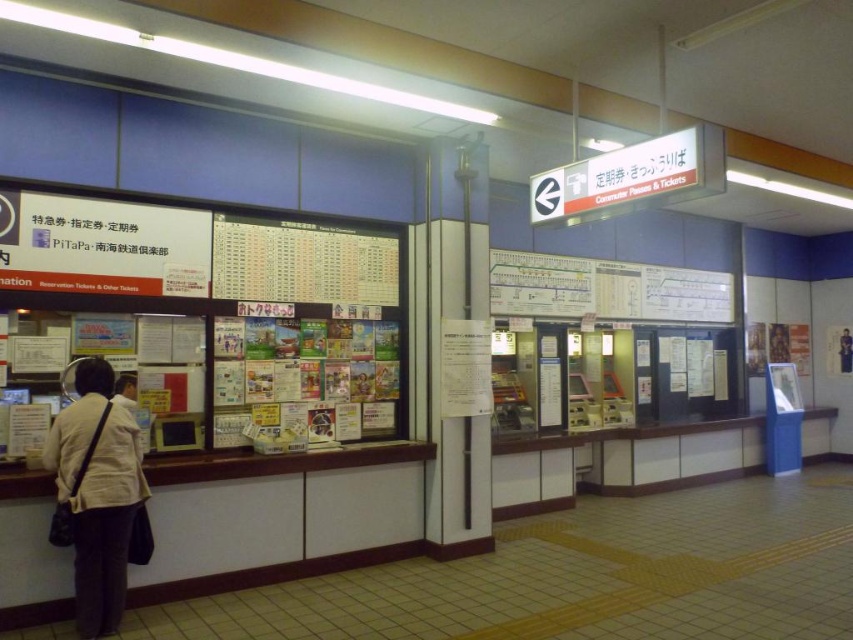
Question: Is beige fabric jacket at lower left above light beige jacket at left?

Choices:
 (A) no
 (B) yes

Answer: (A)

Question: Considering the relative positions of beige fabric jacket at lower left and light beige jacket at left in the image provided, where is beige fabric jacket at lower left located with respect to light beige jacket at left?

Choices:
 (A) left
 (B) right

Answer: (B)

Question: Which point is closer to the camera taking this photo?

Choices:
 (A) (134, 392)
 (B) (102, 449)

Answer: (B)

Question: Which point is closer to the camera taking this photo?

Choices:
 (A) (112, 400)
 (B) (88, 474)

Answer: (B)

Question: Among these points, which one is farthest from the camera?

Choices:
 (A) (123, 403)
 (B) (73, 508)

Answer: (A)

Question: Can you confirm if beige fabric jacket at lower left is positioned to the right of light beige jacket at left?

Choices:
 (A) no
 (B) yes

Answer: (B)